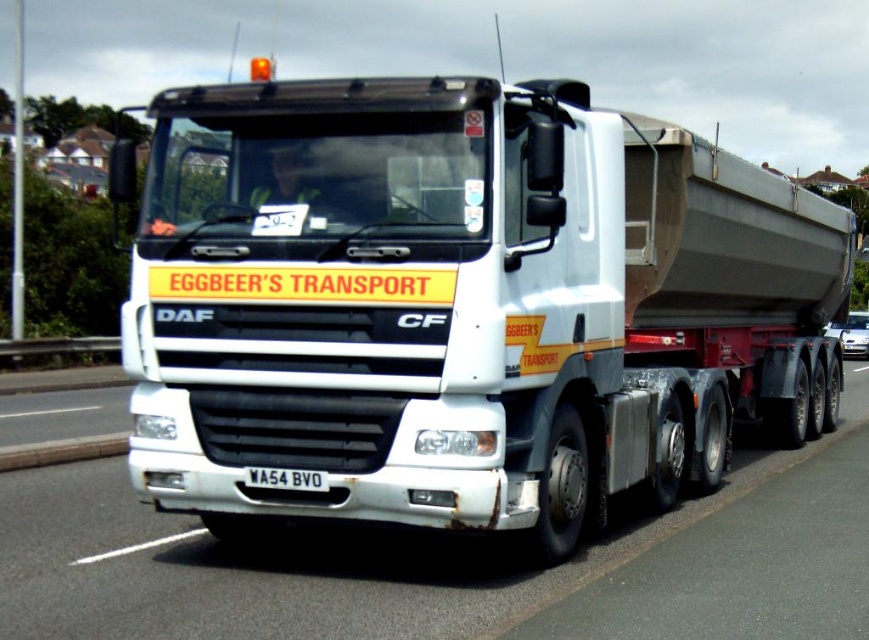
Does white matte truck at center have a smaller size compared to white glossy truck at center?

No.

Describe the element at coordinates (463, 305) in the screenshot. I see `white matte truck at center` at that location.

Where is `white matte truck at center`? This screenshot has width=869, height=640. white matte truck at center is located at coordinates (463, 305).

At what (x,y) coordinates should I click in order to perform the action: click on white matte truck at center. Please return your answer as a coordinate pair (x, y). The width and height of the screenshot is (869, 640). Looking at the image, I should click on (463, 305).

Between point (614, 360) and point (284, 468), which one is positioned in front?

Point (284, 468) is in front.

Between point (410, 500) and point (327, 481), which one is positioned behind?

The point (327, 481) is more distant.

This screenshot has width=869, height=640. Identify the location of white matte truck at center. 463,305.

Who is positioned more to the right, white glossy truck at center or black plastic license plate at center?

white glossy truck at center is more to the right.

Which is in front, point (408, 576) or point (259, 477)?

Point (259, 477) is in front.

Where is `white glossy truck at center`? This screenshot has height=640, width=869. white glossy truck at center is located at coordinates (286, 563).